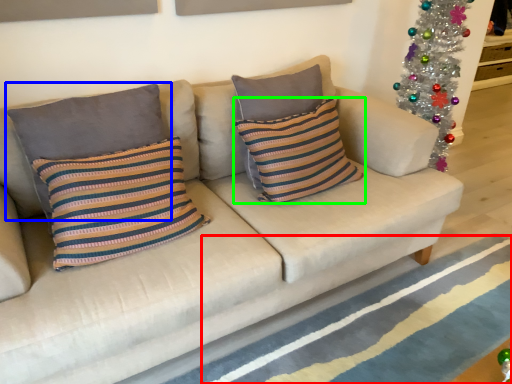
Question: Which object is the farthest from stripe (highlighted by a red box)? Choose among these: pillow (highlighted by a blue box) or pillow (highlighted by a green box).

Choices:
 (A) pillow
 (B) pillow

Answer: (A)